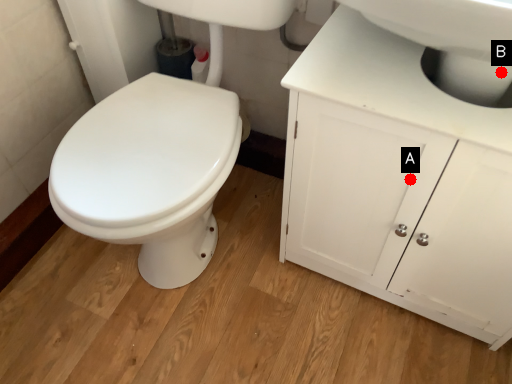
Question: Two points are circled on the image, labeled by A and B beside each circle. Which point is farther from the camera taking this photo?

Choices:
 (A) A is further
 (B) B is further

Answer: (A)